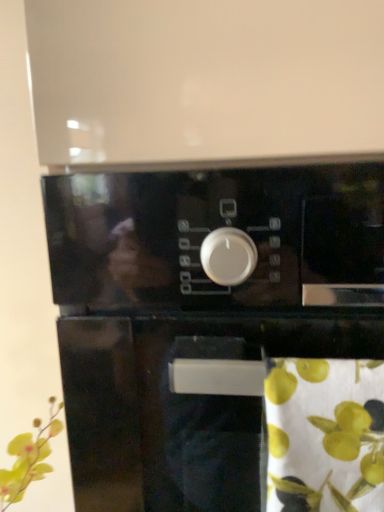
Question: Does green fabric at lower right come in front of black glossy oven at center?

Choices:
 (A) yes
 (B) no

Answer: (A)

Question: Considering the relative sizes of green fabric at lower right and black glossy oven at center in the image provided, is green fabric at lower right bigger than black glossy oven at center?

Choices:
 (A) no
 (B) yes

Answer: (A)

Question: Is green fabric at lower right to the left of black glossy oven at center from the viewer's perspective?

Choices:
 (A) no
 (B) yes

Answer: (A)

Question: Is green fabric at lower right far away from black glossy oven at center?

Choices:
 (A) yes
 (B) no

Answer: (B)

Question: Is green fabric at lower right facing towards black glossy oven at center?

Choices:
 (A) yes
 (B) no

Answer: (A)

Question: From a real-world perspective, is green fabric at lower right on black glossy oven at center?

Choices:
 (A) no
 (B) yes

Answer: (B)

Question: Does black glossy oven at center have a lesser height compared to green fabric at lower right?

Choices:
 (A) yes
 (B) no

Answer: (B)

Question: From the image's perspective, is black glossy oven at center over green fabric at lower right?

Choices:
 (A) no
 (B) yes

Answer: (B)

Question: Is black glossy oven at center closer to camera compared to green fabric at lower right?

Choices:
 (A) yes
 (B) no

Answer: (B)

Question: From the image's perspective, is black glossy oven at center located beneath green fabric at lower right?

Choices:
 (A) yes
 (B) no

Answer: (B)

Question: Would you say black glossy oven at center is outside green fabric at lower right?

Choices:
 (A) no
 (B) yes

Answer: (B)

Question: Considering the relative positions of black glossy oven at center and green fabric at lower right in the image provided, is black glossy oven at center to the right of green fabric at lower right from the viewer's perspective?

Choices:
 (A) no
 (B) yes

Answer: (A)

Question: In the image, is black glossy oven at center positioned in front of or behind green fabric at lower right?

Choices:
 (A) front
 (B) behind

Answer: (B)